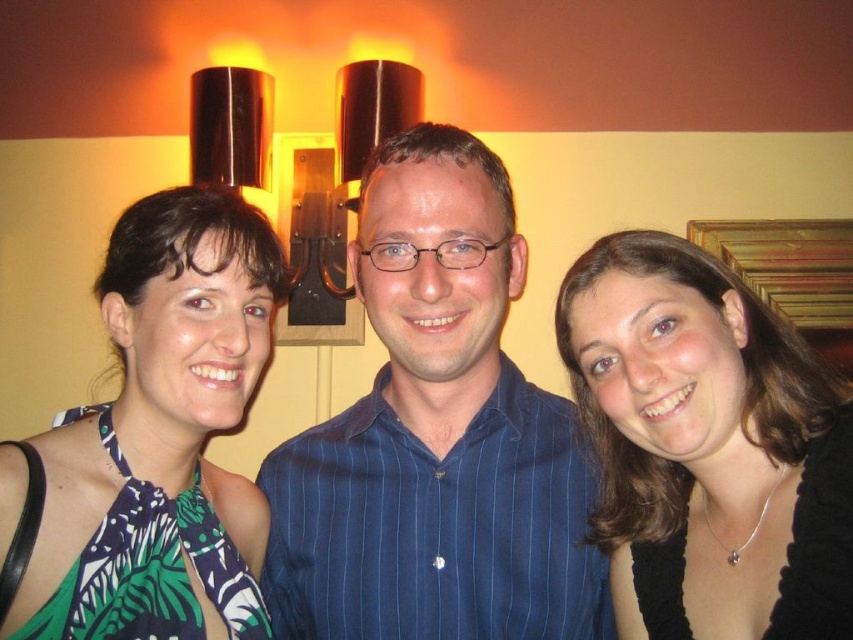
Question: Among these points, which one is nearest to the camera?

Choices:
 (A) (437, 602)
 (B) (65, 561)
 (C) (738, 436)

Answer: (B)

Question: Which point is closer to the camera taking this photo?

Choices:
 (A) pyautogui.click(x=373, y=484)
 (B) pyautogui.click(x=254, y=508)

Answer: (A)

Question: Does blue striped shirt at center have a lesser width compared to matte black necklace at right?

Choices:
 (A) yes
 (B) no

Answer: (B)

Question: Which object is closer to the camera taking this photo?

Choices:
 (A) green printed dress at center
 (B) blue striped shirt at center
 (C) matte black necklace at right

Answer: (A)

Question: Does blue striped shirt at center lie in front of green printed dress at center?

Choices:
 (A) no
 (B) yes

Answer: (A)

Question: From the image, what is the correct spatial relationship of matte black necklace at right in relation to green printed dress at center?

Choices:
 (A) below
 (B) above

Answer: (A)